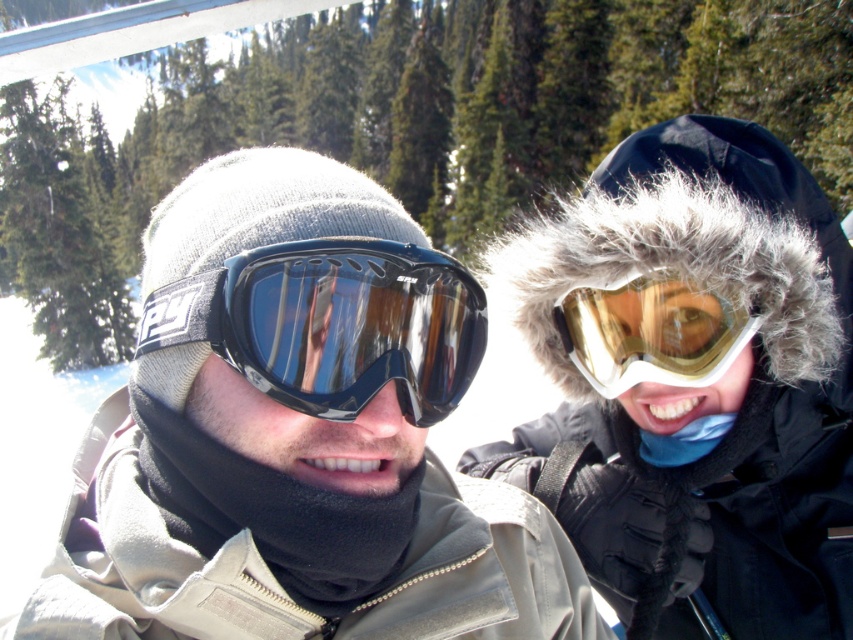
You are standing at the origin point in the image and want to move towards the two points marked in the scene. Which point, point [483,586] or point [363,378], is further away from you?

Point [483,586] is behind point [363,378], so it is further away from you.

You are a photographer trying to capture both the matte black goggles at center and the black glossy goggles at center in a single photo. Which pair of goggles will appear higher in the photo?

The black glossy goggles at center will appear higher in the photo because the matte black goggles at center is positioned below it.